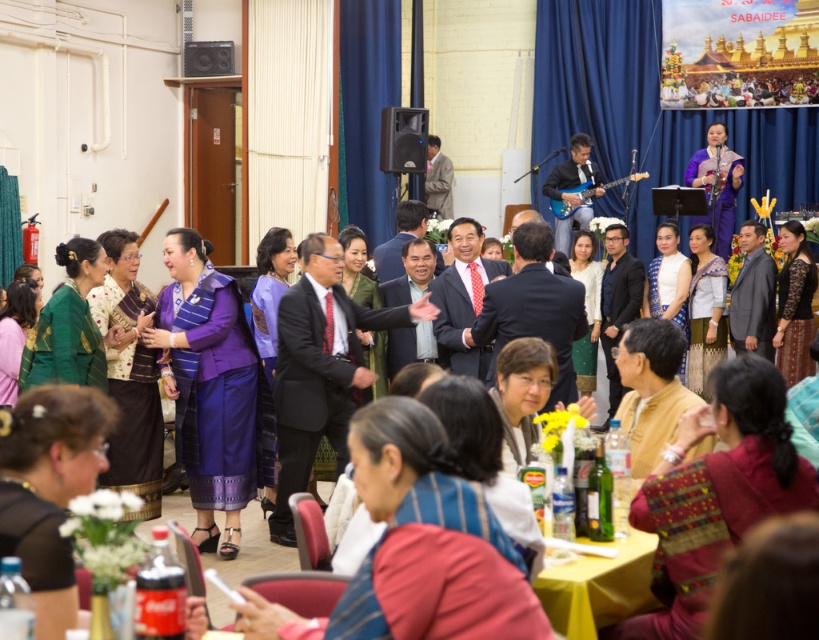
You are a photographer at the event and want to capture both the purple satin dress at upper center and the matte black speaker at upper left in a single frame. Considering their sizes, which object should you focus on first to ensure both are in the frame?

The purple satin dress at upper center is bigger than the matte black speaker at upper left, so you should focus on the purple satin dress at upper center first to ensure both fit in the frame.